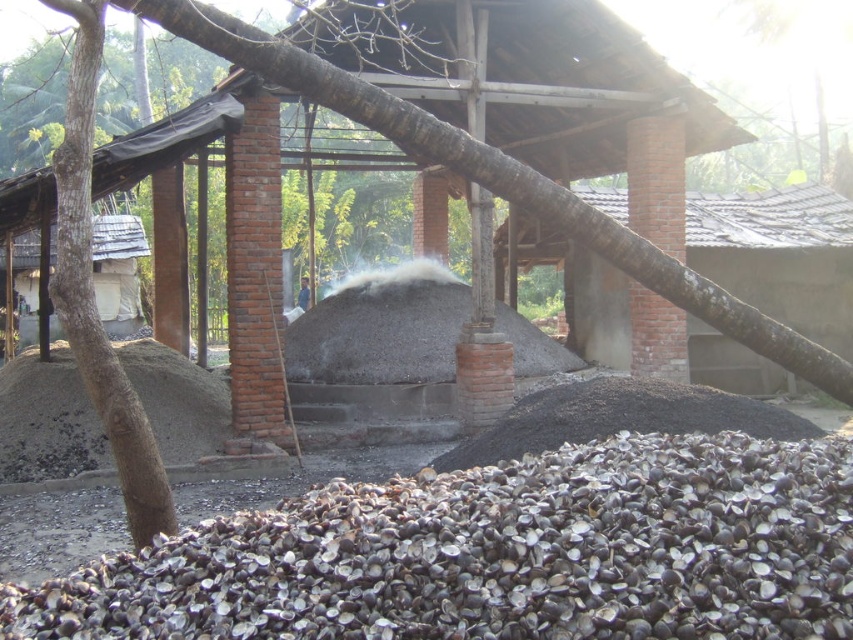
From the picture: You are a construction worker who needs to place a heavy equipment on the gray concrete mound at center and the black gravel pile at lower right. Which location is more stable for placing heavy equipment?

The gray concrete mound at center is positioned over the black gravel pile at lower right, so the gray concrete mound at center is more stable for placing heavy equipment because it is built on top of a solid structure.

You are standing at the point marked as point (500,554) in the image. What is the material you are standing on?

The point (500,554) marks black gravel at lower center, so you are standing on black gravel.